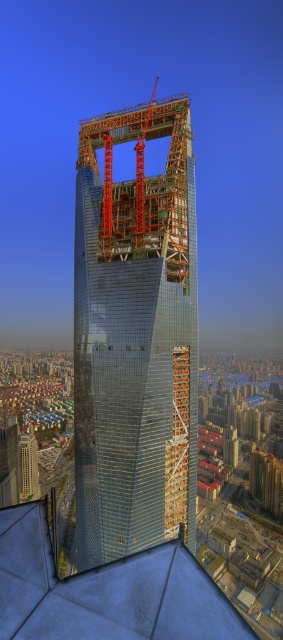
You are an architect observing the construction site of the transparent glass tower at center and the orange metallic crane at upper center. Which object is taller?

The transparent glass tower at center is much taller than the orange metallic crane at upper center.

You are a construction worker standing at the base of the skyscraper. You notice a point marked at coordinates (134,337). Based on the image, where is this point located?

The point is located on the transparent glass tower at center.

In the scene shown: You are an architect standing at the base of the skyscraper. You notice two points marked on the construction plans. The first point is at coordinate point (129, 492) and the second is at point (157, 188). From your current position, which point is closer to you?

Point (129, 492) is in front of point (157, 188), so the first point is closer to you.